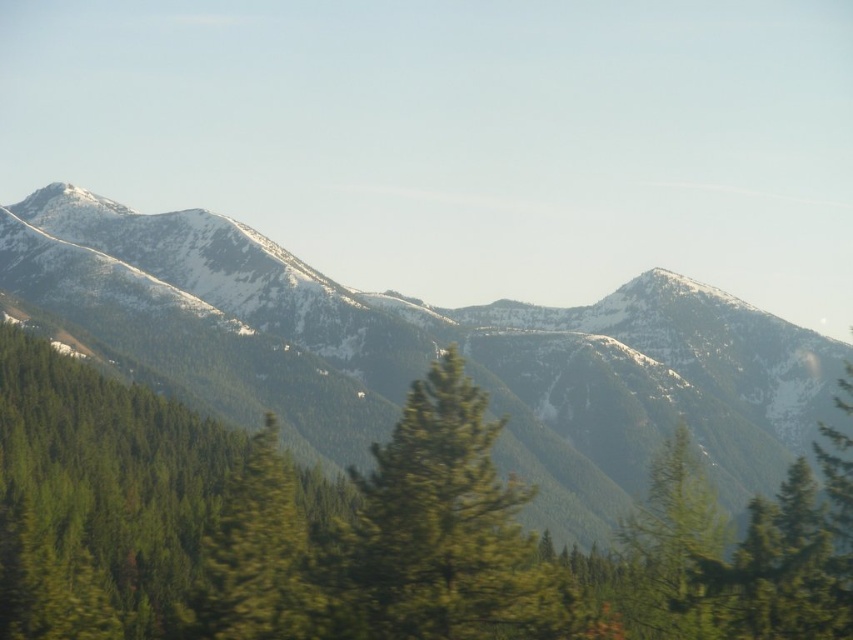
Which is in front, point (282, 289) or point (288, 531)?

Point (288, 531) is more forward.

The height and width of the screenshot is (640, 853). What do you see at coordinates (460, 348) in the screenshot?
I see `snowy rocky mountain range at center` at bounding box center [460, 348].

Measure the distance between point (548, 442) and camera.

A distance of 1511.86 feet exists between point (548, 442) and camera.

At what (x,y) coordinates should I click in order to perform the action: click on snowy rocky mountain range at center. Please return your answer as a coordinate pair (x, y). The height and width of the screenshot is (640, 853). Looking at the image, I should click on (460, 348).

Does snowy rocky mountain range at center lie behind green textured tree at center?

Yes.

Who is more distant from viewer, (467, 355) or (523, 576)?

Positioned behind is point (467, 355).

This screenshot has width=853, height=640. Identify the location of snowy rocky mountain range at center. (460, 348).

Based on the photo, can you confirm if green textured tree at center is positioned to the left of green matte tree at center?

Incorrect, green textured tree at center is not on the left side of green matte tree at center.

I want to click on green textured tree at center, so click(444, 532).